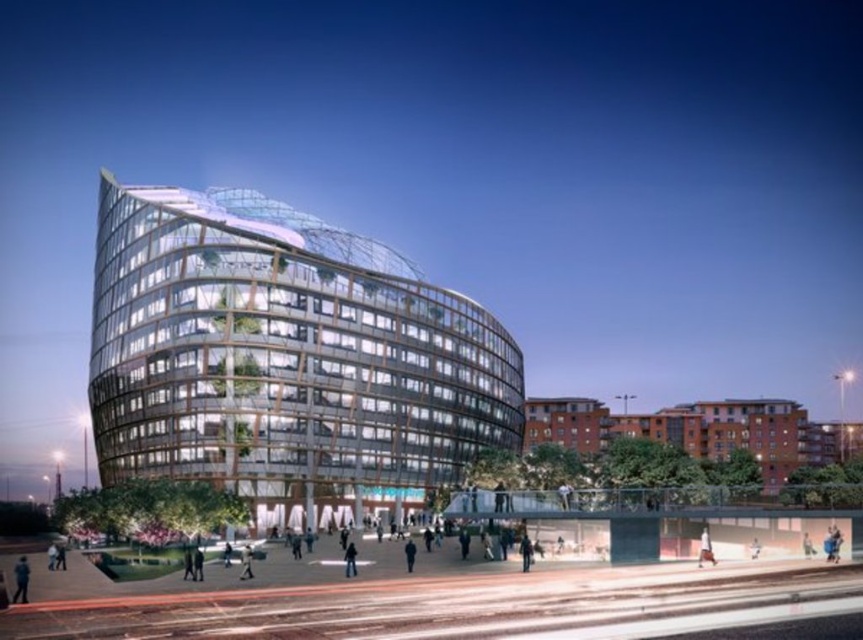
What do you see at coordinates (20, 580) in the screenshot?
I see `blue fabric jacket at lower left` at bounding box center [20, 580].

Between blue fabric jacket at lower left and light gray fabric jacket at lower center, which one appears on the right side from the viewer's perspective?

Positioned to the right is light gray fabric jacket at lower center.

The width and height of the screenshot is (863, 640). I want to click on blue fabric jacket at lower left, so click(x=20, y=580).

Can you confirm if transparent glass building at center is positioned above light gray fabric jacket at lower center?

Indeed, transparent glass building at center is positioned over light gray fabric jacket at lower center.

Can you confirm if transparent glass building at center is wider than light gray fabric jacket at lower center?

Yes.

Measure the distance between transparent glass building at center and camera.

transparent glass building at center and camera are 266.78 feet apart.

I want to click on transparent glass building at center, so click(x=284, y=356).

Can you confirm if blue fabric jacket at lower left is positioned below dark blue fabric at center?

Incorrect, blue fabric jacket at lower left is not positioned below dark blue fabric at center.

Does blue fabric jacket at lower left have a lesser height compared to dark blue fabric at center?

No, blue fabric jacket at lower left is not shorter than dark blue fabric at center.

Who is more forward, (x=28, y=576) or (x=347, y=572)?

Positioned in front is point (x=28, y=576).

This screenshot has width=863, height=640. I want to click on blue fabric jacket at lower left, so click(x=20, y=580).